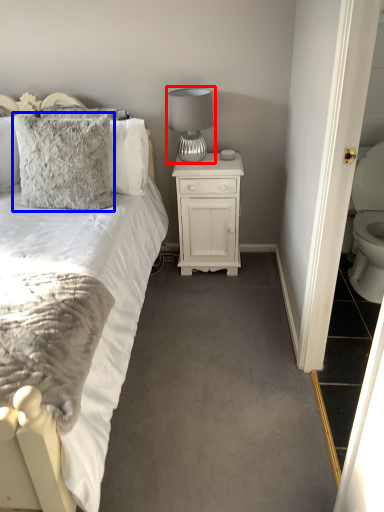
Question: Which of the following is the closest to the observer, table lamp (highlighted by a red box) or pillow (highlighted by a blue box)?

Choices:
 (A) table lamp
 (B) pillow

Answer: (B)